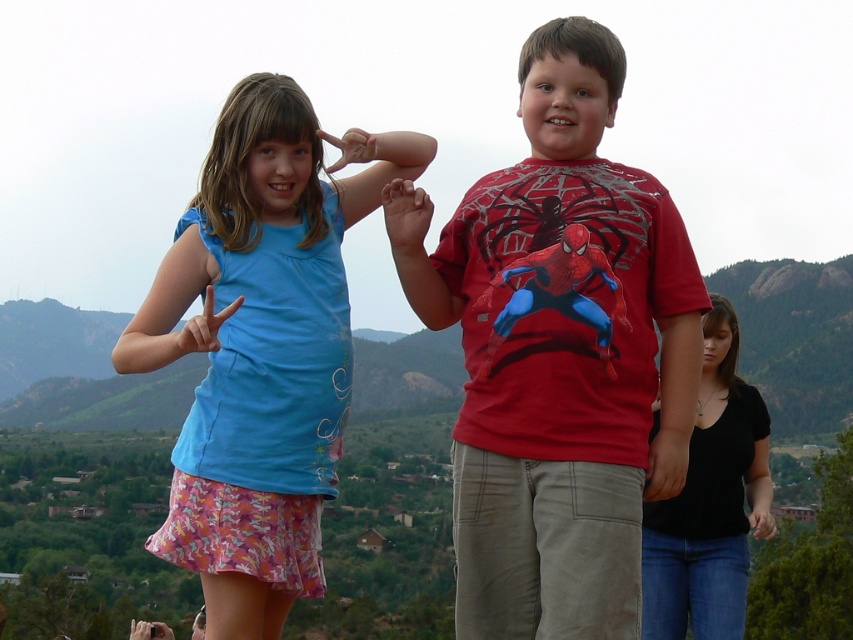
Which is more to the right, matte spider-man t-shirt at center or matte blue shirt at center?

Positioned to the right is matte spider-man t-shirt at center.

Who is more forward, (511,589) or (264,464)?

Point (511,589) is more forward.

Is point (616, 600) behind point (274, 333)?

No, (616, 600) is in front of (274, 333).

Identify the location of matte spider-man t-shirt at center. (558, 353).